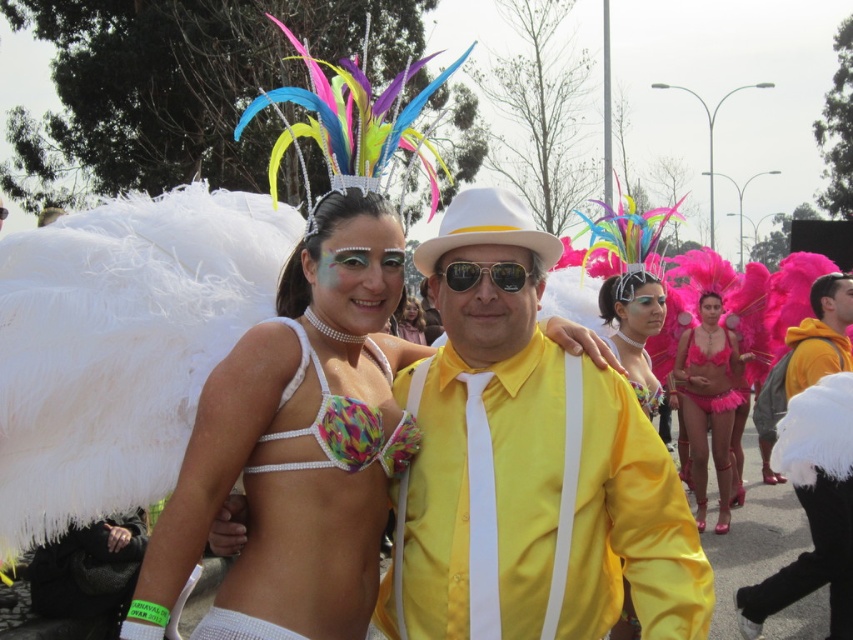
Is yellow satin shirt at center positioned before matte pink bikini at center?

Yes, it is.

You are a GUI agent. You are given a task and a screenshot of the screen. Output one action in this format:
    pyautogui.click(x=<x>, y=<y>)
    Task: Click on the yellow satin shirt at center
    
    Given the screenshot: What is the action you would take?
    pyautogui.click(x=529, y=470)

Based on the photo, can you confirm if yellow satin suit at center is bigger than fuzzy pink bikini at center?

No, yellow satin suit at center is not bigger than fuzzy pink bikini at center.

Is point (817, 532) closer to camera compared to point (698, 358)?

Yes, point (817, 532) is in front of point (698, 358).

At what (x,y) coordinates should I click in order to perform the action: click on yellow satin suit at center. Please return your answer as a coordinate pair (x, y). The width and height of the screenshot is (853, 640). Looking at the image, I should click on click(x=814, y=464).

The image size is (853, 640). Find the location of `yellow satin suit at center`. yellow satin suit at center is located at coordinates (814, 464).

Is yellow satin shirt at center to the right of matte pink feathers at center from the viewer's perspective?

Incorrect, yellow satin shirt at center is not on the right side of matte pink feathers at center.

How much distance is there between yellow satin shirt at center and matte pink feathers at center?

A distance of 6.16 feet exists between yellow satin shirt at center and matte pink feathers at center.

Does point (433, 394) lie behind point (640, 344)?

No, it is not.

The image size is (853, 640). Identify the location of yellow satin shirt at center. (529, 470).